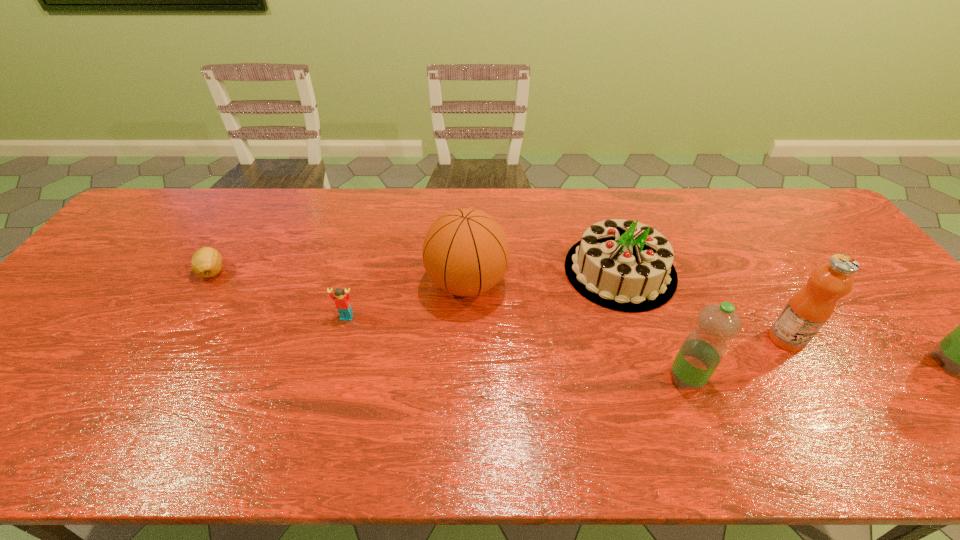
Please point out where to position a new water bottle on the left to maintain spacing. Please provide its 2D coordinates. Your answer should be formatted as a tuple, i.e. [(x, y)], where the tuple contains the x and y coordinates of a point satisfying the conditions above.

[(404, 394)]